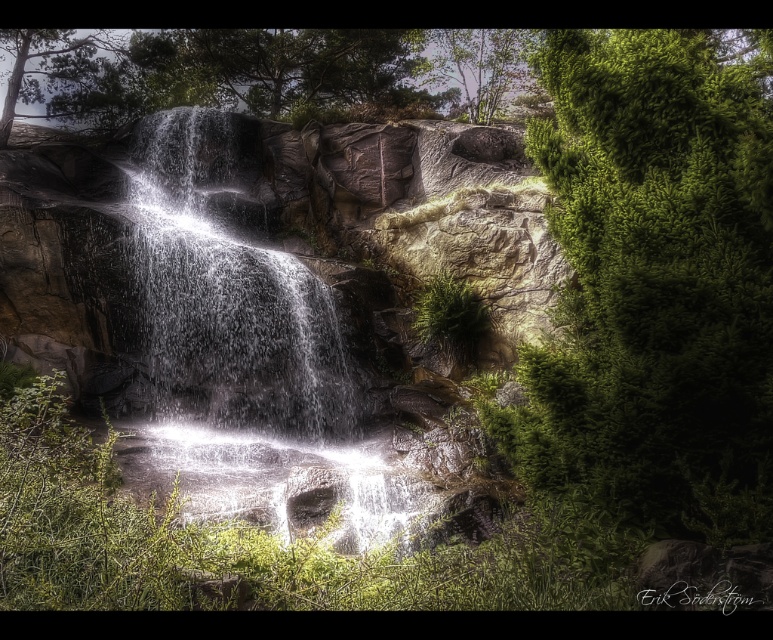
You are standing at the base of the waterfall and want to take a photo of both the green textured bush at right and the green matte tree at upper left. Which object should you focus on first to ensure both are in clear view?

You should focus on the green textured bush at right first since it is closer to you than the green matte tree at upper left, ensuring both are in focus when using a camera with depth of field considerations.

You are a hiker trying to take a photo of the green leafy tree at upper center. However, there is a green textured bush at right blocking your view. Can you move to the left or right to get a clear shot of the tree?

The green textured bush at right is in front of the green leafy tree at upper center, so moving to the left might provide a clearer view by positioning yourself around the bush to avoid obstruction.

You are a hiker trying to navigate through the area. You need to decide which object to use for shade. Which one is larger between the green textured bush at right and the green matte tree at upper left?

The green textured bush at right is bigger than the green matte tree at upper left, so it would provide more shade.